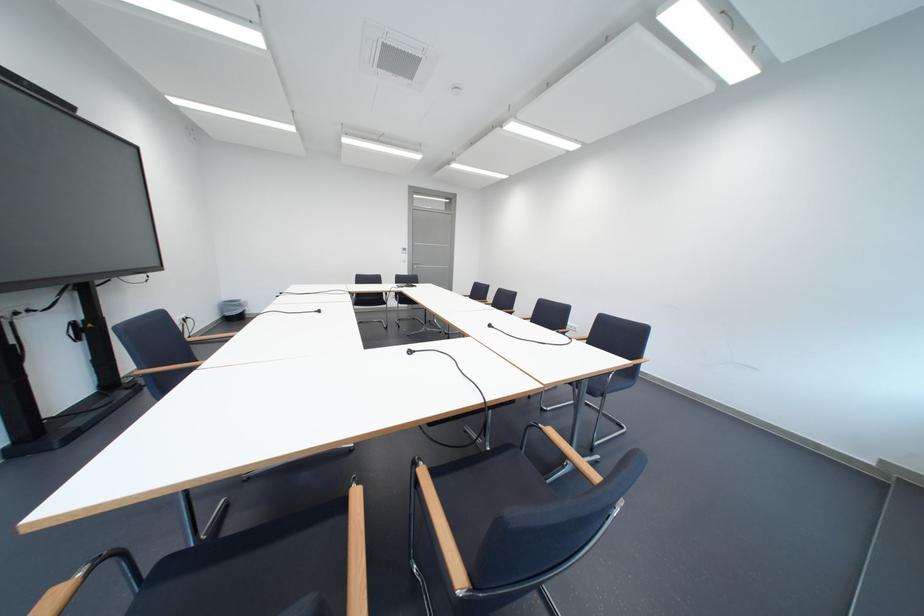
Where is `vertical door handle`? The image size is (924, 616). vertical door handle is located at coordinates (416, 265).